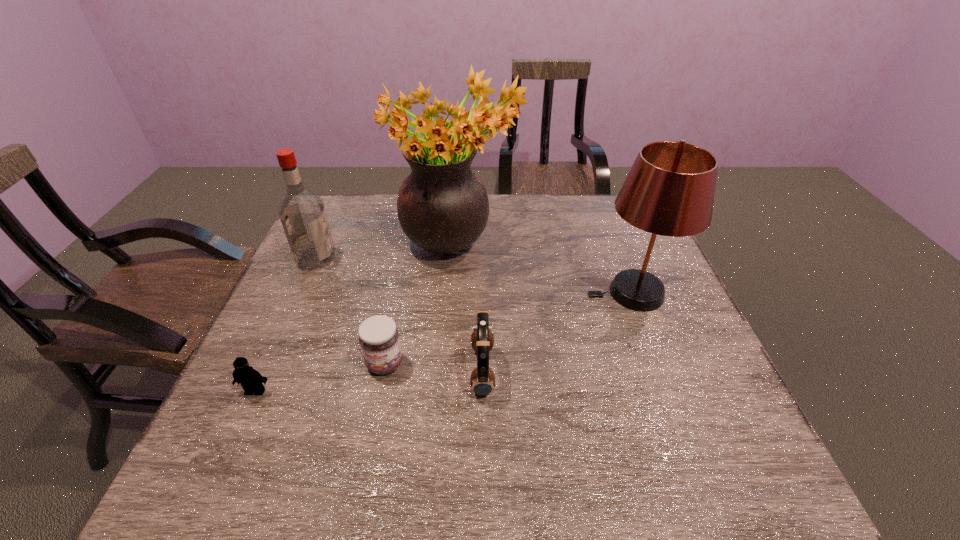
At what (x,y) coordinates should I click in order to perform the action: click on vacant region between the liquor and the rightmost object. Please return your answer as a coordinate pair (x, y). The image size is (960, 540). Looking at the image, I should click on (474, 276).

Find the location of `empty space between the rightmost object and the fourth shortest object`. empty space between the rightmost object and the fourth shortest object is located at coordinates (474, 276).

Identify the location of unoccupied area between the third tallest object and the jam. (350, 311).

The height and width of the screenshot is (540, 960). I want to click on vacant space in between the Lego and the rightmost object, so click(444, 342).

This screenshot has height=540, width=960. In order to click on free space between the lampshade and the Lego in this screenshot , I will do `click(444, 342)`.

Identify the location of vacant space that is in between the fourth shortest object and the headset. (399, 315).

Image resolution: width=960 pixels, height=540 pixels. In order to click on object that is the third closest to the third tallest object in this screenshot , I will do `click(251, 380)`.

Locate an element on the screen. object that is the fifth closest to the Lego is located at coordinates (x=669, y=191).

The image size is (960, 540). Identify the location of blank area in the image that satisfies the following two spatial constraints: 1. on the front-facing side of the fourth shortest object; 2. on the face of the Lego. pyautogui.click(x=257, y=391).

Find the location of a particular element. This screenshot has width=960, height=540. vacant point that satisfies the following two spatial constraints: 1. on the front side of the flower arrangement; 2. on the front-facing side of the liquor is located at coordinates (456, 259).